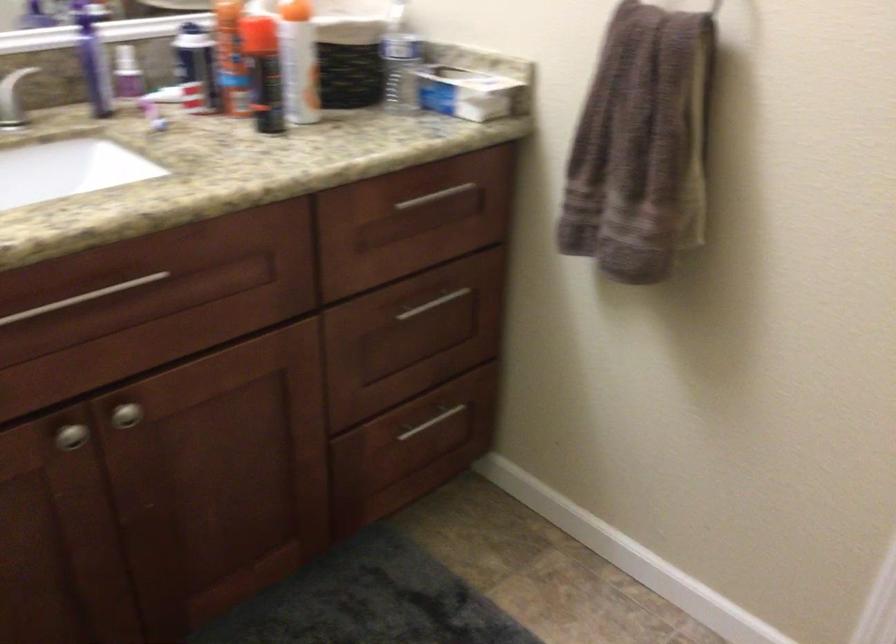
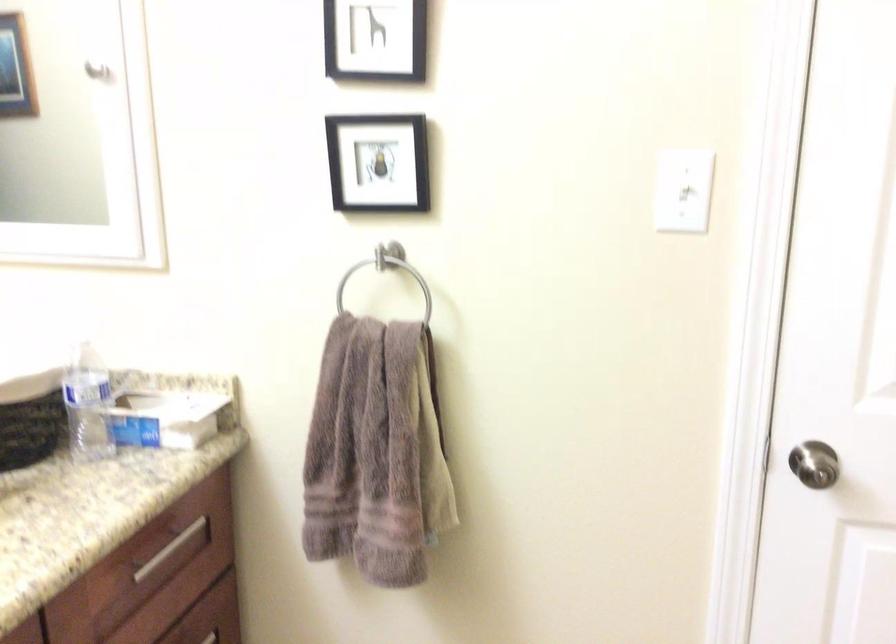
Question: How did the camera likely rotate?

Choices:
 (A) Left
 (B) Right
 (C) Up
 (D) Down

Answer: (B)